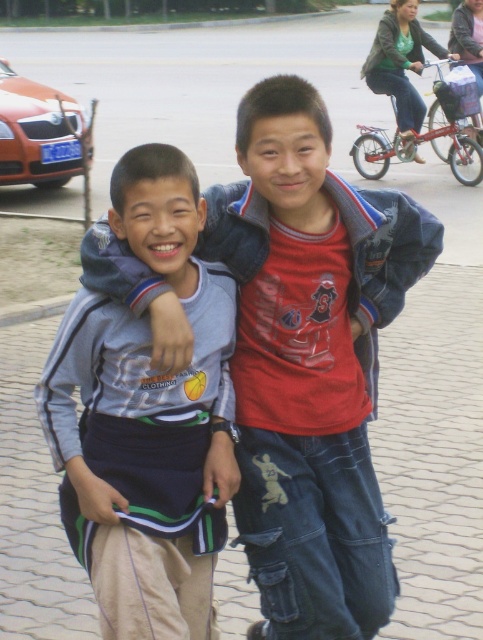
Question: Which object appears closest to the camera in this image?

Choices:
 (A) gray fabric shirt at left
 (B) denim jacket at upper right
 (C) matte gray hoodie at center

Answer: (A)

Question: Which point is farther to the camera?

Choices:
 (A) (298, 289)
 (B) (397, 96)
 (C) (170, 406)

Answer: (B)

Question: From the image, what is the correct spatial relationship of gray fabric shirt at left in relation to denim jacket at upper right?

Choices:
 (A) right
 (B) left

Answer: (B)

Question: Which object is positioned farthest from the matte gray hoodie at center?

Choices:
 (A) gray fabric shirt at left
 (B) denim jacket at upper right

Answer: (B)

Question: Can you confirm if matte gray hoodie at center is positioned above gray fabric shirt at left?

Choices:
 (A) yes
 (B) no

Answer: (A)

Question: Is matte gray hoodie at center positioned at the back of gray fabric shirt at left?

Choices:
 (A) yes
 (B) no

Answer: (A)